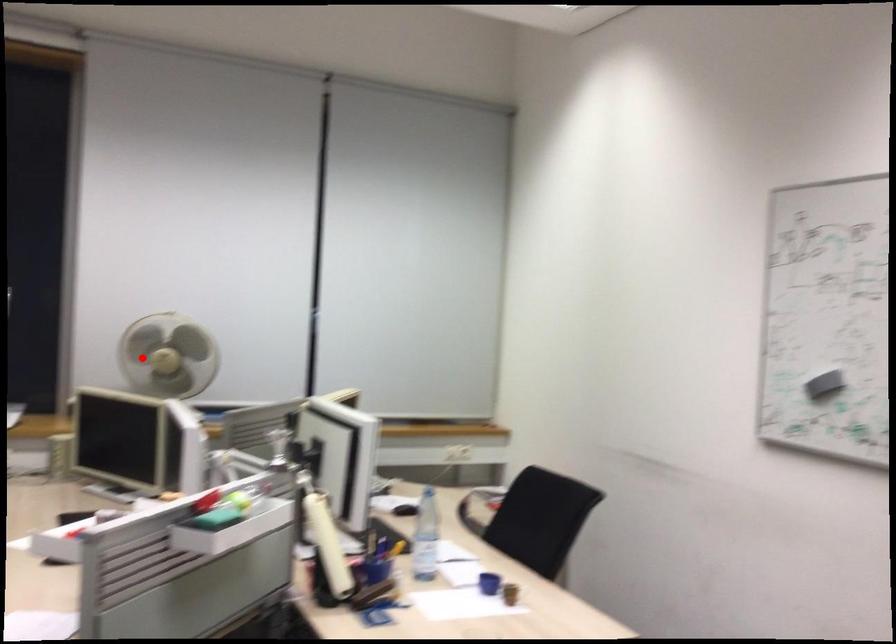
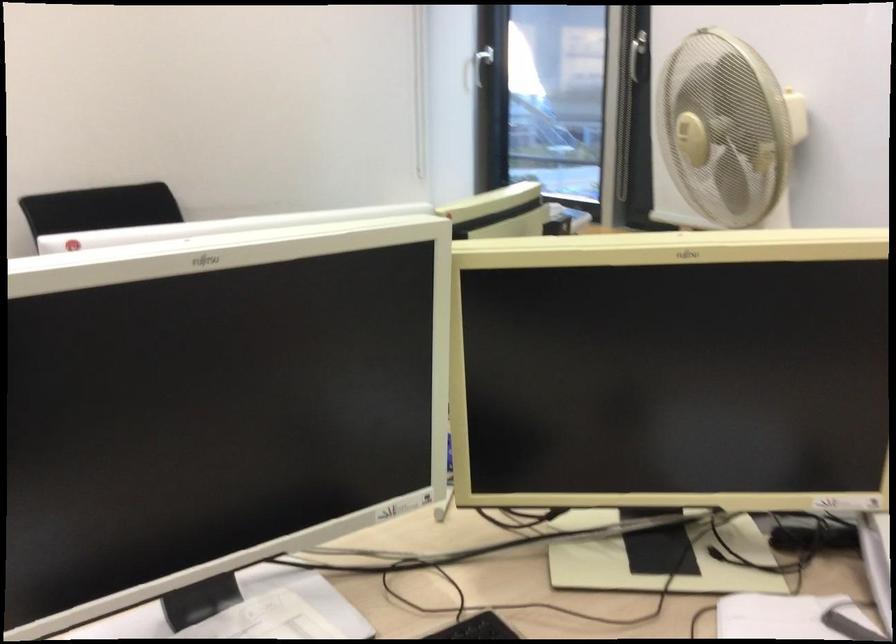
The point at the highlighted location is marked in the first image. Where is the corresponding point in the second image?

(685, 129)